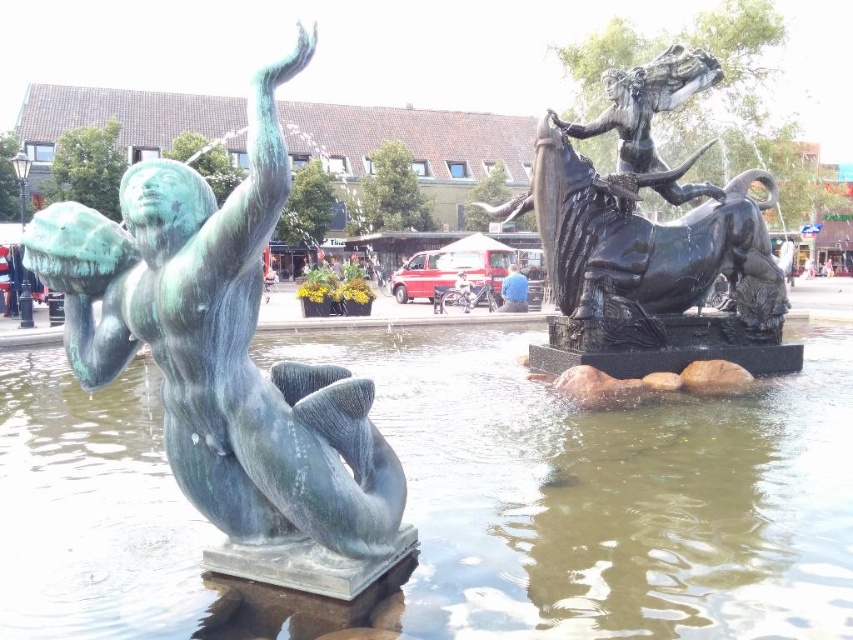
You are standing in the public square and want to take a photo of the two sculptures. The camera you are using has a maximum focus range of 8 meters. Can you focus on the point at coordinates point (711, 243) without moving closer?

The point at coordinates point (711, 243) is 8.79 meters from the camera, which exceeds the camera maximum focus range of 8 meters. Therefore, you cannot focus on the point at coordinates point (711, 243) without moving closer.

You are standing in the public square and notice two items at the center of the fountain area. Which one is positioned to the left when looking at the green patina water at center and blue cotton shirt at center?

The green patina water at center is located to the left of the blue cotton shirt at center.

You are standing in the public square and want to take a photo of the polished bronze statue at center. If your camera has a maximum focus range of 8 meters, will you be able to focus on the statue?

The polished bronze statue at center is 8.55 meters away from the camera, which exceeds the camera maximum focus range of 8 meters. Therefore, the camera cannot focus on the statue.